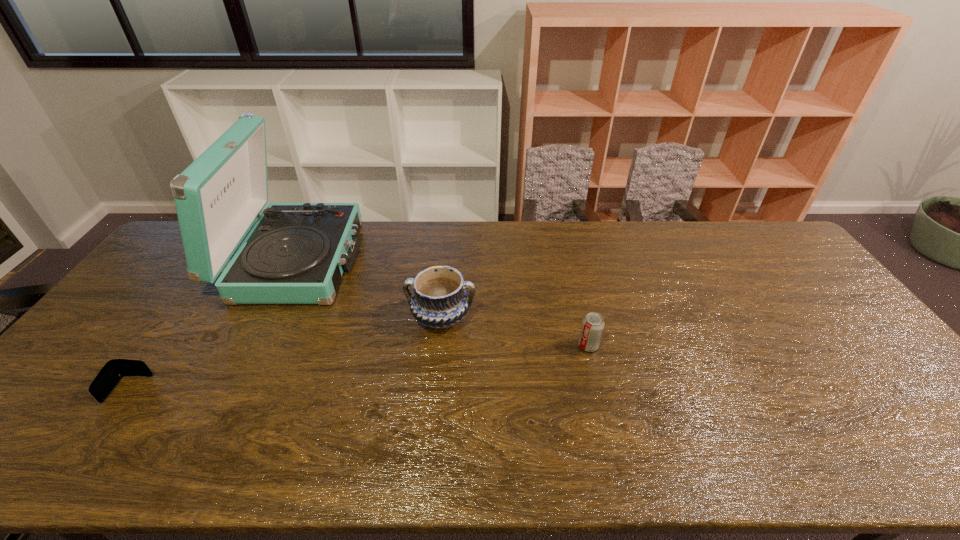
The image size is (960, 540). In order to click on vacant region located 0.210m on the back of the third tallest object in this screenshot , I will do `click(574, 287)`.

This screenshot has width=960, height=540. I want to click on vacant space located 0.100m on the outer surface of the nearest object, so click(x=89, y=444).

The width and height of the screenshot is (960, 540). In order to click on object positioned at the far edge in this screenshot , I will do `click(296, 253)`.

This screenshot has width=960, height=540. I want to click on object that is at the left edge, so click(115, 369).

Find the location of a particular element. This screenshot has height=540, width=960. free location at the far edge of the desktop is located at coordinates (724, 232).

The image size is (960, 540). What are the coordinates of `vacant space at the near edge of the desktop` in the screenshot? It's located at pos(119,463).

In the image, there is a desktop. Where is `free space at the right edge`? Image resolution: width=960 pixels, height=540 pixels. free space at the right edge is located at coordinates (876, 386).

The height and width of the screenshot is (540, 960). Find the location of `free location at the near left corner`. free location at the near left corner is located at coordinates (14, 445).

Image resolution: width=960 pixels, height=540 pixels. Find the location of `blank space at the far right corner of the desktop`. blank space at the far right corner of the desktop is located at coordinates (754, 234).

At what (x,y) coordinates should I click in order to perform the action: click on vacant position at the near right corner of the desktop. Please return your answer as a coordinate pair (x, y). The width and height of the screenshot is (960, 540). Looking at the image, I should click on (921, 461).